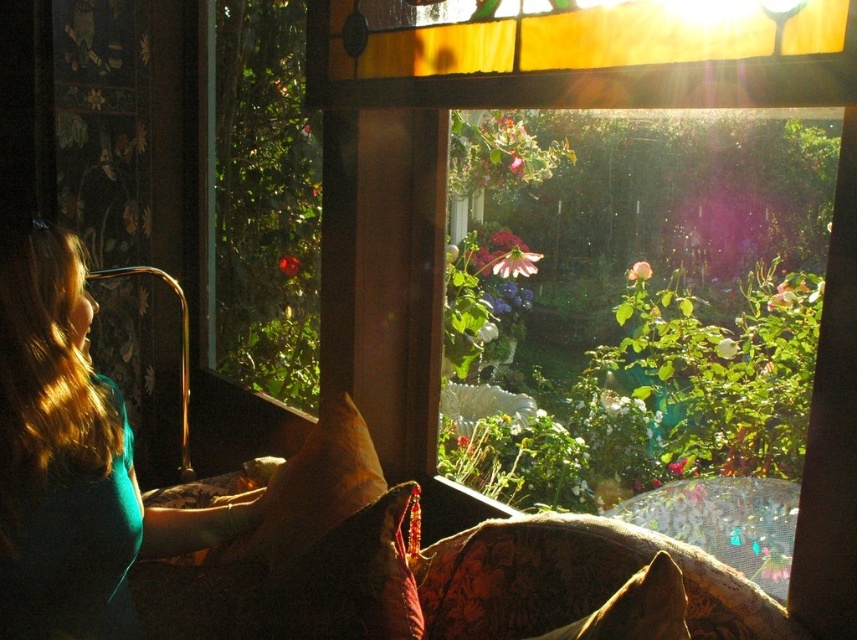
Between transparent glass window at upper center and teal fabric shirt at left, which one appears on the right side from the viewer's perspective?

transparent glass window at upper center

Between point (475, 476) and point (67, 244), which one is positioned behind?

The point (475, 476) is behind.

Identify the location of transparent glass window at upper center. The height and width of the screenshot is (640, 857). (661, 356).

Is transparent glass window at upper center wider than green leafy plant at upper left?

Indeed, transparent glass window at upper center has a greater width compared to green leafy plant at upper left.

Is transparent glass window at upper center thinner than green leafy plant at upper left?

Incorrect, transparent glass window at upper center's width is not less than green leafy plant at upper left's.

Which is behind, point (704, 456) or point (273, 184)?

Point (273, 184)

Where is `transparent glass window at upper center`? This screenshot has height=640, width=857. transparent glass window at upper center is located at coordinates (661, 356).

Can you confirm if transparent glass window at upper center is positioned to the right of brown textured pillow at lower center?

Indeed, transparent glass window at upper center is positioned on the right side of brown textured pillow at lower center.

Who is positioned more to the right, transparent glass window at upper center or brown textured pillow at lower center?

Positioned to the right is transparent glass window at upper center.

Is point (746, 465) positioned after point (606, 620)?

Yes.

Find the location of a particular element. The width and height of the screenshot is (857, 640). transparent glass window at upper center is located at coordinates (661, 356).